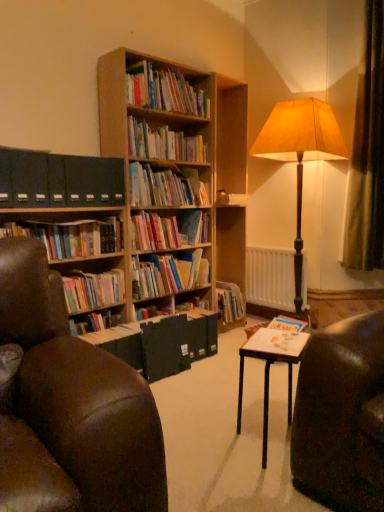
Locate an element on the screen. The height and width of the screenshot is (512, 384). vacant space underneath wooden table at center (from a real-world perspective) is located at coordinates (260, 441).